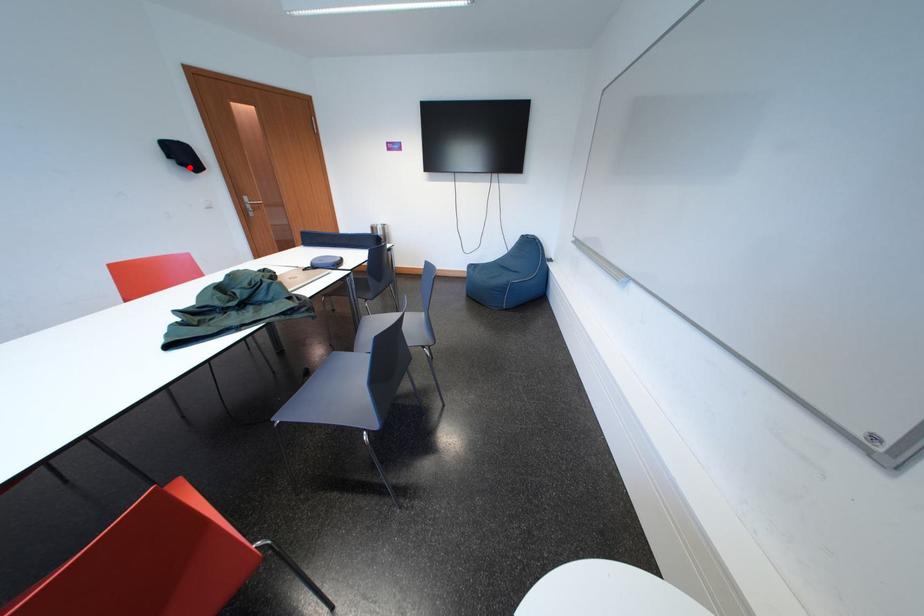
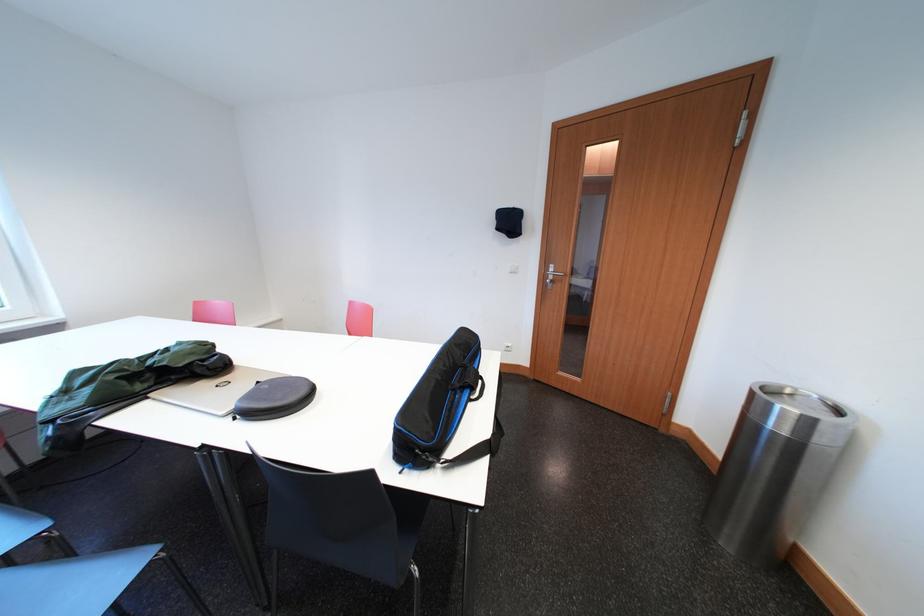
The point at the highlighted location is marked in the first image. Where is the corresponding point in the second image?

(506, 233)